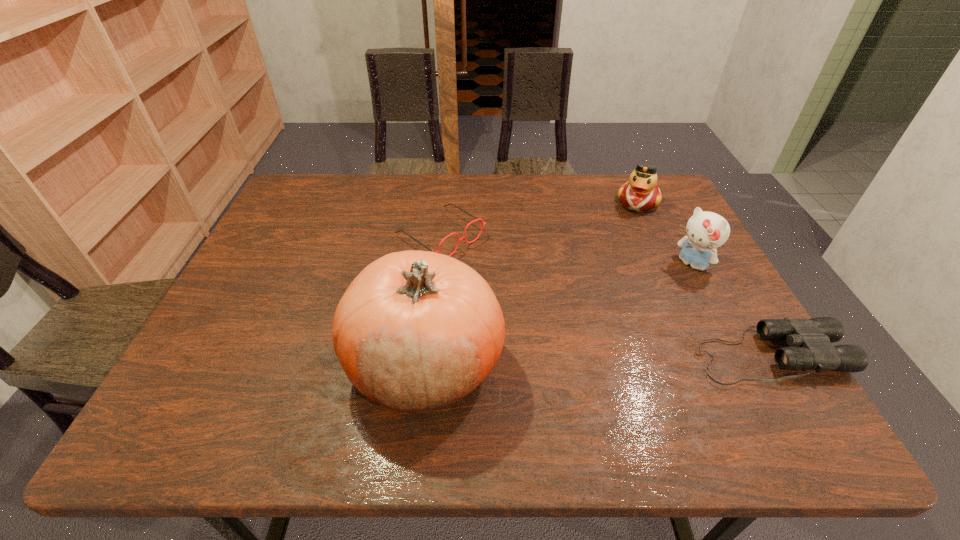
Locate an element on the screen. free region that satisfies the following two spatial constraints: 1. on the back side of the tallest object; 2. on the right side of the third tallest object is located at coordinates (444, 202).

This screenshot has width=960, height=540. I want to click on vacant space that satisfies the following two spatial constraints: 1. on the back side of the pumpkin; 2. at the eyepiece of the binoculars, so click(x=427, y=356).